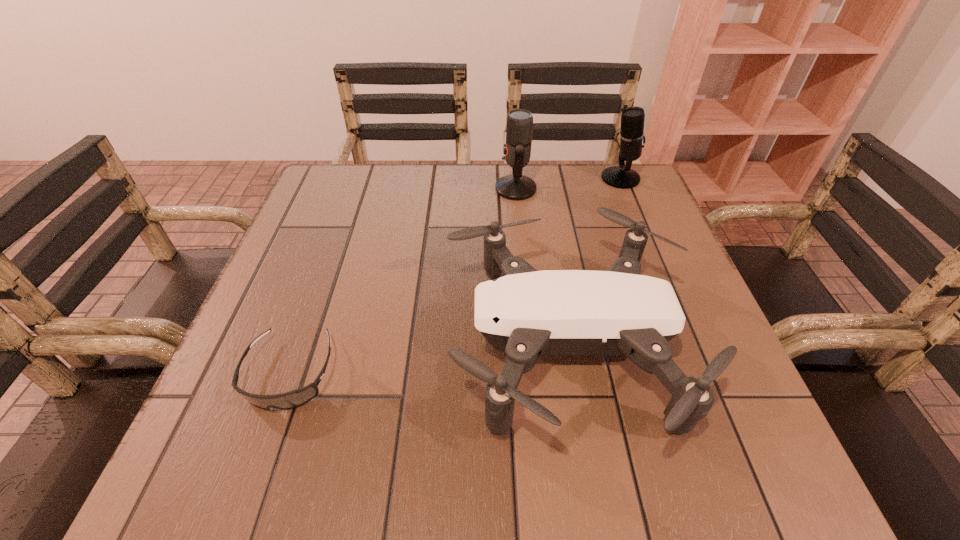
You are a GUI agent. You are given a task and a screenshot of the screen. Output one action in this format:
    pyautogui.click(x=<x>, y=<y>)
    Task: Click on the vacant space that's between the drone and the left microphone
    This screenshot has height=540, width=960.
    Given the screenshot: What is the action you would take?
    pyautogui.click(x=540, y=266)

You are a GUI agent. You are given a task and a screenshot of the screen. Output one action in this format:
    pyautogui.click(x=<x>, y=<y>)
    Task: Click on the free spot between the right microphone and the leftmost object
    The image size is (960, 540).
    Given the screenshot: What is the action you would take?
    pyautogui.click(x=455, y=276)

Locate an element on the screen. vacant space in between the right microphone and the drone is located at coordinates (592, 261).

Where is `free space between the right microphone and the drone`? This screenshot has width=960, height=540. free space between the right microphone and the drone is located at coordinates (592, 261).

Where is `the third closest object to the left microphone`? Image resolution: width=960 pixels, height=540 pixels. the third closest object to the left microphone is located at coordinates (295, 398).

Image resolution: width=960 pixels, height=540 pixels. In order to click on object that is the closest to the left microphone in this screenshot , I will do `click(632, 137)`.

Locate an element on the screen. blank area in the image that satisfies the following two spatial constraints: 1. on the camera side of the drone; 2. on the lenses of the leftmost object is located at coordinates (570, 373).

Locate an element on the screen. The width and height of the screenshot is (960, 540). free region that satisfies the following two spatial constraints: 1. on the front side of the right microphone; 2. on the side of the left microphone with the red ring is located at coordinates (625, 189).

In order to click on free space that satisfies the following two spatial constraints: 1. on the camera side of the drone; 2. on the lenses of the leftmost object in this screenshot , I will do [570, 373].